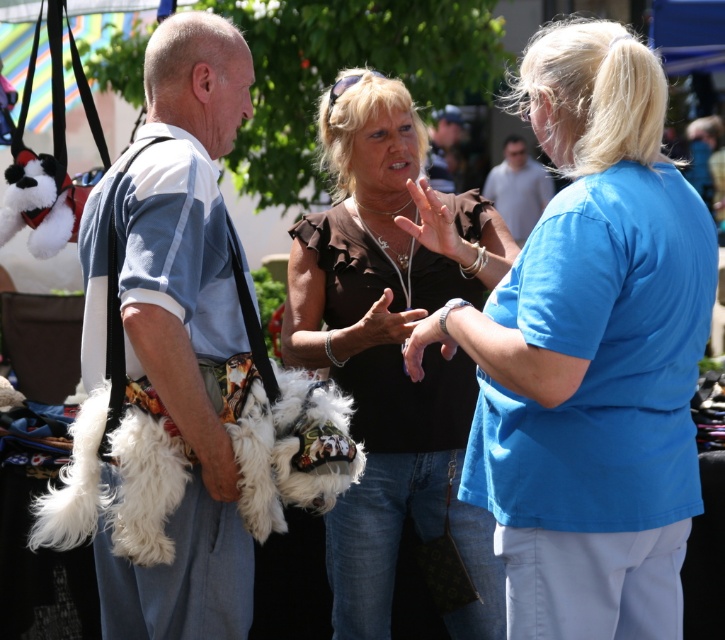
Is white fluffy dog at center closer to camera compared to matte brown leather wallet at center?

Yes.

Who is more forward, (65, 476) or (442, 192)?

Point (65, 476)

Does point (315, 465) lie behind point (442, 164)?

No, (315, 465) is in front of (442, 164).

In order to click on white fluffy dog at center in this screenshot , I will do `click(120, 481)`.

Is blue cotton shirt at upper right above brown ruffled shirt at center?

Yes.

Which is behind, point (465, 480) or point (326, 125)?

Positioned behind is point (326, 125).

Measure the distance between point (521, 444) and camera.

Point (521, 444) is 3.58 meters from camera.

Where is `blue cotton shirt at upper right`? This screenshot has height=640, width=725. blue cotton shirt at upper right is located at coordinates (589, 353).

Who is taller, blue cotton shirt at upper right or white fur bag at left?

Standing taller between the two is white fur bag at left.

Which is behind, point (626, 58) or point (218, 477)?

Point (218, 477)

Is point (547, 310) closer to viewer compared to point (162, 620)?

That is True.

Where is `blue cotton shirt at upper right`? blue cotton shirt at upper right is located at coordinates (589, 353).